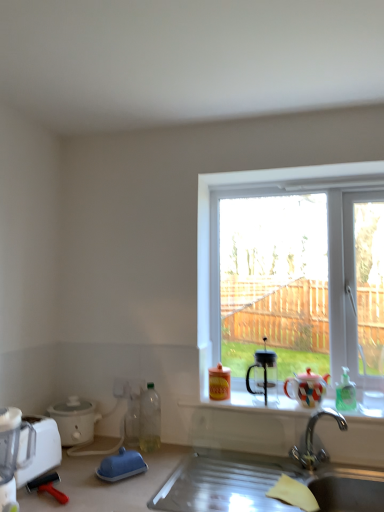
Question: Does white matte slow cooker at lower left, arranged as the 2th appliance when viewed from the left, have a greater width compared to white plastic blender at lower left?

Choices:
 (A) no
 (B) yes

Answer: (B)

Question: Is white matte slow cooker at lower left, arranged as the 2th appliance when viewed from the left, at the left side of white plastic blender at lower left?

Choices:
 (A) no
 (B) yes

Answer: (A)

Question: Considering the relative sizes of white matte slow cooker at lower left, the 3th appliance from the front, and white plastic blender at lower left in the image provided, is white matte slow cooker at lower left, the 3th appliance from the front, smaller than white plastic blender at lower left?

Choices:
 (A) yes
 (B) no

Answer: (B)

Question: Is the surface of white matte slow cooker at lower left, which is the second appliance from right to left, in direct contact with white plastic blender at lower left?

Choices:
 (A) no
 (B) yes

Answer: (A)

Question: From a real-world perspective, is white matte slow cooker at lower left, arranged as the 2th appliance when viewed from the left, over white plastic blender at lower left?

Choices:
 (A) no
 (B) yes

Answer: (A)

Question: Looking at their shapes, would you say transparent glass window at upper center is wider or thinner than white matte slow cooker at lower left, the 1th appliance from the back?

Choices:
 (A) thin
 (B) wide

Answer: (A)

Question: From the image's perspective, relative to white matte slow cooker at lower left, arranged as the 2th appliance when viewed from the left, is transparent glass window at upper center above or below?

Choices:
 (A) above
 (B) below

Answer: (A)

Question: Considering the positions of transparent glass window at upper center and white matte slow cooker at lower left, the 3th appliance from the front, in the image, is transparent glass window at upper center taller or shorter than white matte slow cooker at lower left, the 3th appliance from the front,?

Choices:
 (A) tall
 (B) short

Answer: (A)

Question: In the image, is transparent glass window at upper center positioned in front of or behind white matte slow cooker at lower left, the 3th appliance from the front?

Choices:
 (A) front
 (B) behind

Answer: (B)

Question: In terms of size, does white plastic blender at lower left, marked as the third appliance in a right-to-left arrangement, appear bigger or smaller than white plastic blender at lower left?

Choices:
 (A) small
 (B) big

Answer: (B)

Question: Does point pos(46,439) appear closer or farther from the camera than point pos(19,422)?

Choices:
 (A) closer
 (B) farther

Answer: (B)

Question: In terms of width, does white plastic blender at lower left, arranged as the 3th appliance when viewed from the back, look wider or thinner when compared to white plastic blender at lower left?

Choices:
 (A) wide
 (B) thin

Answer: (A)

Question: From the image's perspective, is white plastic blender at lower left, marked as the third appliance in a right-to-left arrangement, located above or below white plastic blender at lower left?

Choices:
 (A) above
 (B) below

Answer: (B)

Question: From the image's perspective, is blue rubber squeegee at lower left, arranged as the first appliance when viewed from the right, positioned above or below translucent plastic bottle at lower left, placed as the 1th bottle when sorted from left to right?

Choices:
 (A) below
 (B) above

Answer: (A)

Question: From a real-world perspective, is blue rubber squeegee at lower left, which ranks as the third appliance in left-to-right order, physically located above or below translucent plastic bottle at lower left, placed as the 1th bottle when sorted from left to right?

Choices:
 (A) below
 (B) above

Answer: (A)